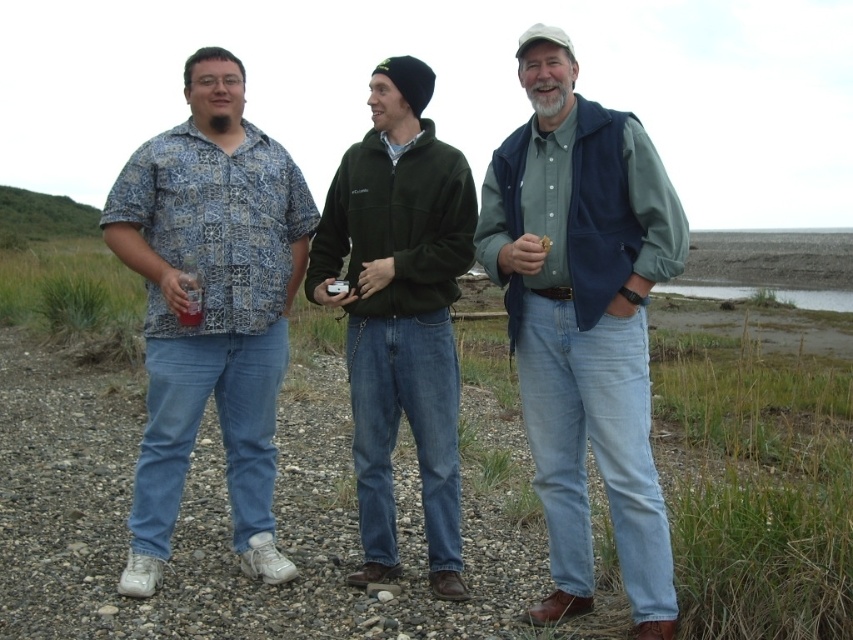
Is navy blue vest at center to the left of patterned fabric shirt at left from the viewer's perspective?

Incorrect, navy blue vest at center is not on the left side of patterned fabric shirt at left.

Is the position of navy blue vest at center more distant than that of patterned fabric shirt at left?

That is False.

Where is `navy blue vest at center`? The width and height of the screenshot is (853, 640). navy blue vest at center is located at coordinates (584, 321).

In the scene shown: Who is positioned more to the right, patterned fabric shirt at left or green fleece jacket at center?

green fleece jacket at center is more to the right.

Is patterned fabric shirt at left thinner than green fleece jacket at center?

Correct, patterned fabric shirt at left's width is less than green fleece jacket at center's.

At what (x,y) coordinates should I click in order to perform the action: click on patterned fabric shirt at left. Please return your answer as a coordinate pair (x, y). Image resolution: width=853 pixels, height=640 pixels. Looking at the image, I should click on (210, 307).

The image size is (853, 640). What are the coordinates of `patterned fabric shirt at left` in the screenshot? It's located at tap(210, 307).

Is navy blue vest at center bigger than green fleece jacket at center?

Correct, navy blue vest at center is larger in size than green fleece jacket at center.

Is point (505, 157) more distant than point (369, 268)?

No.

You are a GUI agent. You are given a task and a screenshot of the screen. Output one action in this format:
    pyautogui.click(x=<x>, y=<y>)
    Task: Click on the navy blue vest at center
    This screenshot has height=640, width=853.
    Given the screenshot: What is the action you would take?
    pyautogui.click(x=584, y=321)